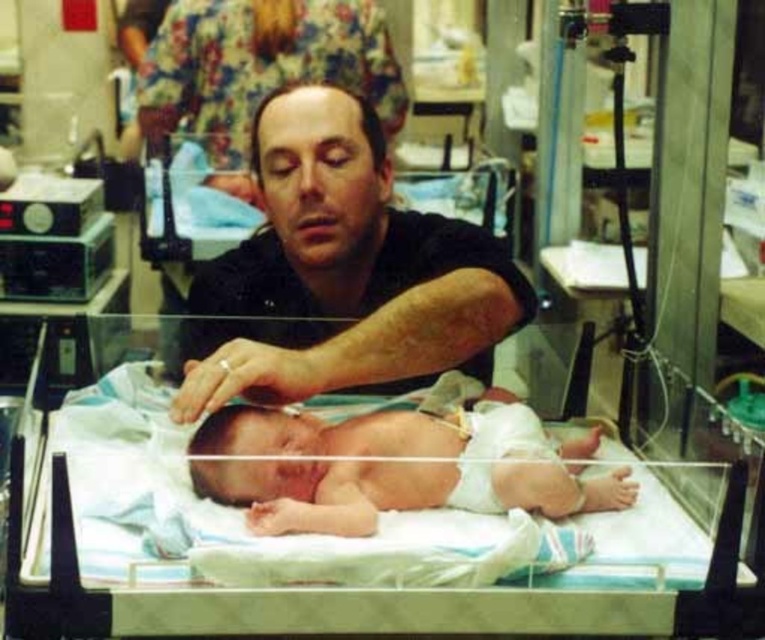
Which is behind, point (487, 564) or point (267, 371)?

Point (267, 371)

Which is below, white fabric hospital bed at center or smooth skin man at center?

Positioned lower is white fabric hospital bed at center.

This screenshot has width=765, height=640. I want to click on white fabric hospital bed at center, so click(x=347, y=548).

The height and width of the screenshot is (640, 765). Find the location of `white fabric hospital bed at center`. white fabric hospital bed at center is located at coordinates (347, 548).

Does white fabric hospital bed at center have a smaller size compared to smooth skin newborn at center?

No.

Which of these two, white fabric hospital bed at center or smooth skin newborn at center, stands shorter?

smooth skin newborn at center

You are a GUI agent. You are given a task and a screenshot of the screen. Output one action in this format:
    pyautogui.click(x=<x>, y=<y>)
    Task: Click on the white fabric hospital bed at center
    This screenshot has height=640, width=765.
    Given the screenshot: What is the action you would take?
    pyautogui.click(x=347, y=548)

Between point (321, 106) and point (233, 433), which one is positioned in front?

Point (233, 433)

Does smooth skin man at center come behind smooth skin newborn at center?

Yes, smooth skin man at center is further from the viewer.

Which is in front, point (355, 189) or point (484, 492)?

Positioned in front is point (484, 492).

In order to click on smooth skin man at center in this screenshot , I will do `click(347, 266)`.